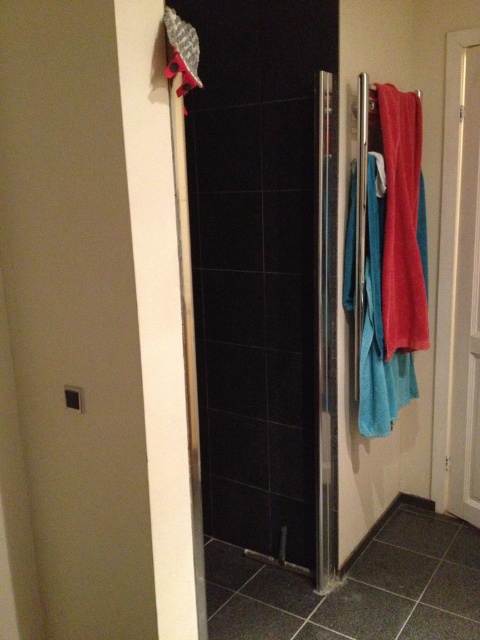
Who is more forward, (467, 467) or (416, 260)?

Point (416, 260) is more forward.

Is white glossy door at right shorter than matte red towel at right?

In fact, white glossy door at right may be taller than matte red towel at right.

Measure the distance between white glossy door at right and camera.

white glossy door at right and camera are 2.43 meters apart.

This screenshot has width=480, height=640. I want to click on white glossy door at right, so click(x=458, y=289).